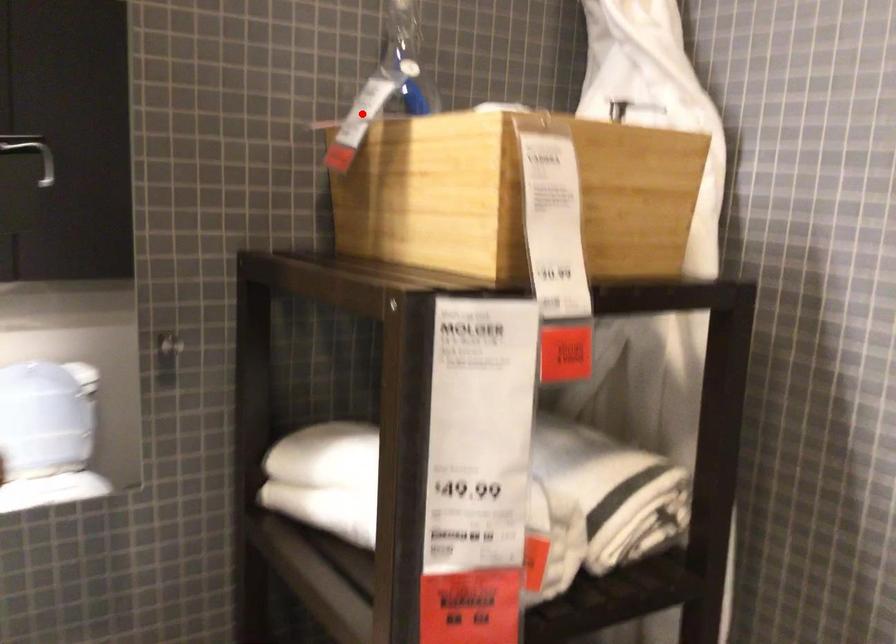
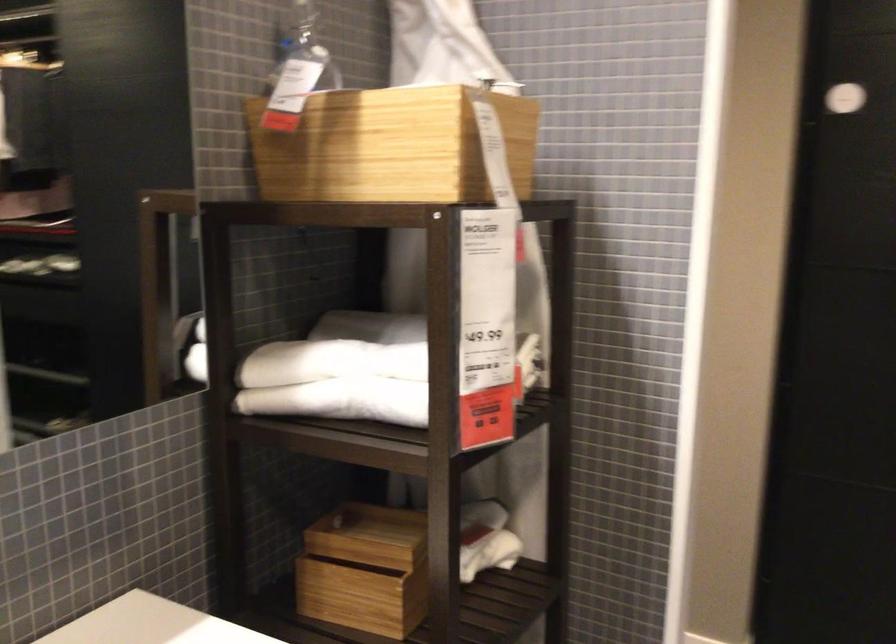
Question: I am providing you with two images of the same scene from different viewpoints. In image1, a red point is highlighted. Considering the same 3D point in image2, which of the following is correct?

Choices:
 (A) It is closer
 (B) It is farther

Answer: (B)